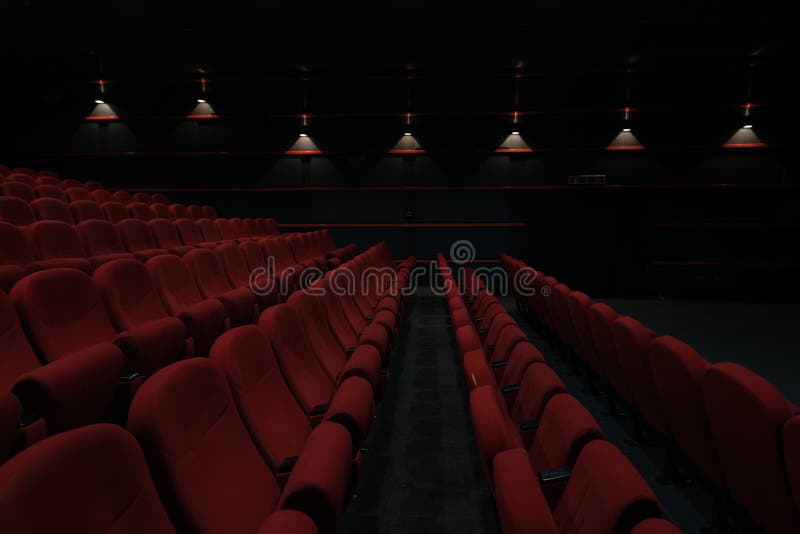
At what (x,y) coordinates should I click in order to perform the action: click on overhead lights. Please return your answer as a coordinate pair (x, y). The width and height of the screenshot is (800, 534). Looking at the image, I should click on (748, 123), (626, 129), (516, 128), (406, 131), (301, 133), (198, 98), (94, 100).